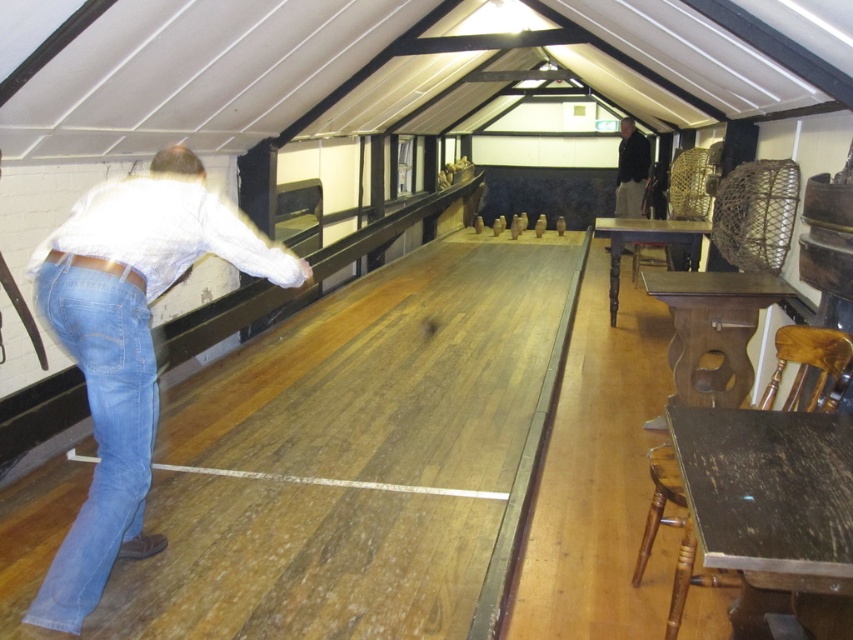
Question: Is blue denim jeans at left smaller than blue denim jeans at lower left?

Choices:
 (A) yes
 (B) no

Answer: (B)

Question: In this image, where is blue denim jeans at lower left located relative to black fabric at right?

Choices:
 (A) below
 (B) above

Answer: (A)

Question: Can you confirm if blue denim jeans at left is positioned to the right of black fabric at right?

Choices:
 (A) yes
 (B) no

Answer: (B)

Question: Which point is farther to the camera?

Choices:
 (A) (68, 321)
 (B) (625, 204)
 (C) (296, 260)

Answer: (B)

Question: Based on their relative distances, which object is nearer to the blue denim jeans at lower left?

Choices:
 (A) black fabric at right
 (B) blue denim jeans at left

Answer: (B)

Question: Which point is closer to the camera?

Choices:
 (A) (86, 272)
 (B) (631, 138)
 (C) (138, 337)

Answer: (A)